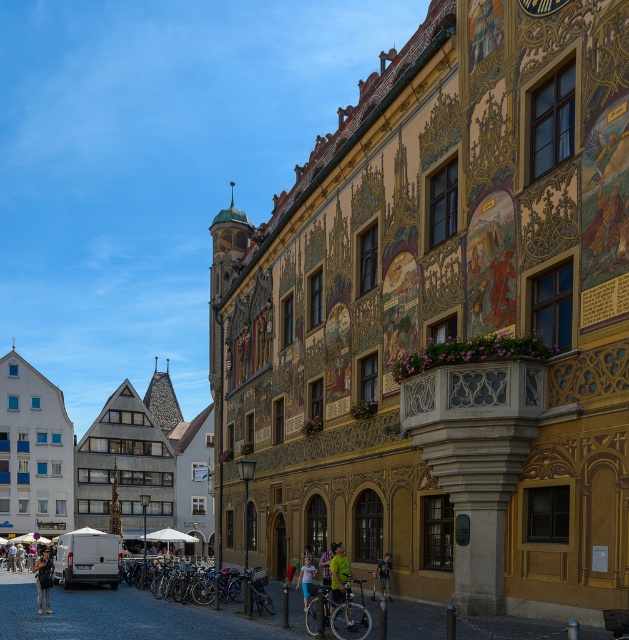
You are a photographer trying to capture a person wearing both the green jersey at center and light blue denim shorts at lower center. Since you want to focus on the clothing items, which one should you zoom in on more to ensure it takes up more space in your photo?

The light blue denim shorts at lower center should be zoomed in on more because it has a greater width compared to the green jersey at center, meaning it naturally occupies more space and would require closer focus to highlight its details.

You are standing in the historic European town and looking at the grand yellow building with colorful murals. There are two points marked on the building. The first point is at coordinates point (347, 570) and the second is at point (309, 563). Which point is closer to you when you are facing the building?

Point (347, 570) is in front of point (309, 563), so when facing the building, point (347, 570) is closer to you.

You are a tourist in this historic town and want to take a photo of the white textured building at center. However, there is a denim jacket at lower left in the way. Can you estimate if the building is bigger than the jacket?

The white textured building at center is larger in size than the denim jacket at lower left, so yes, the building is bigger than the jacket.